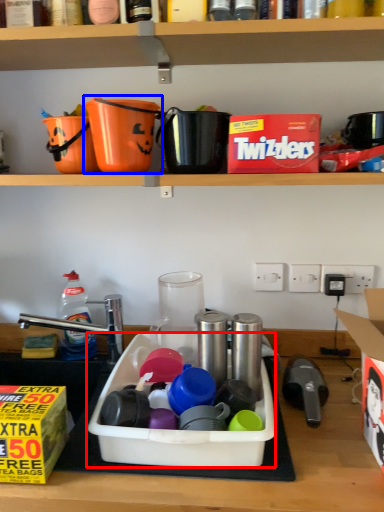
Question: Which object is closer to the camera taking this photo, sink (highlighted by a red box) or appliance (highlighted by a blue box)?

Choices:
 (A) sink
 (B) appliance

Answer: (A)